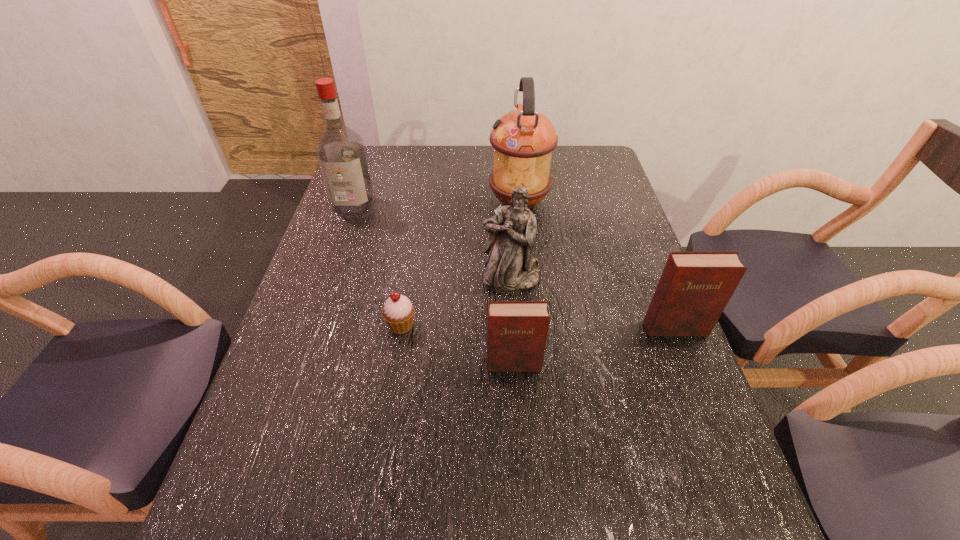
Where is `free point located 0.230m on the front cover of the left diary`? free point located 0.230m on the front cover of the left diary is located at coordinates (520, 479).

At what (x,y) coordinates should I click in order to perform the action: click on blank space located on the front cover of the rightmost object. Please return your answer as a coordinate pair (x, y). Image resolution: width=960 pixels, height=540 pixels. Looking at the image, I should click on (695, 381).

I want to click on blank area located on the front of the oil lamp, so click(524, 247).

I want to click on vacant space located 0.150m on the front of the shortest object, so click(x=390, y=395).

At what (x,y) coordinates should I click in order to perform the action: click on vacant area situated 0.090m on the front-facing side of the fourth nearest object. Please return your answer as a coordinate pair (x, y). This screenshot has height=540, width=960. Looking at the image, I should click on (514, 320).

Locate an element on the screen. vacant area situated on the front-facing side of the leftmost object is located at coordinates (322, 299).

You are a GUI agent. You are given a task and a screenshot of the screen. Output one action in this format:
    pyautogui.click(x=<x>, y=<y>)
    Task: Click on the object that is positioned at the left edge
    This screenshot has height=540, width=960.
    Given the screenshot: What is the action you would take?
    pyautogui.click(x=340, y=151)

Identify the location of object that is at the right edge. (695, 287).

Where is `vacant space at the far edge of the desktop`? vacant space at the far edge of the desktop is located at coordinates (402, 149).

Image resolution: width=960 pixels, height=540 pixels. I want to click on vacant space at the near edge of the desktop, so click(638, 477).